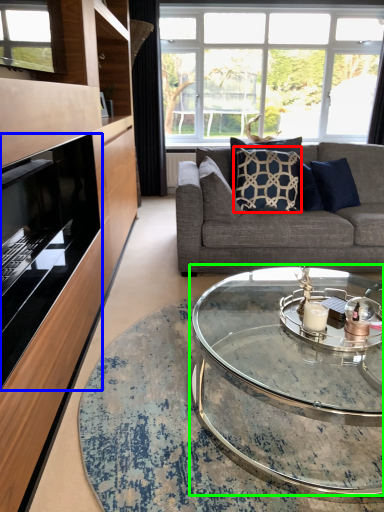
Question: Considering the real-world distances, which object is closest to pillow (highlighted by a red box)? fireplace (highlighted by a blue box) or coffee table (highlighted by a green box).

Choices:
 (A) fireplace
 (B) coffee table

Answer: (B)